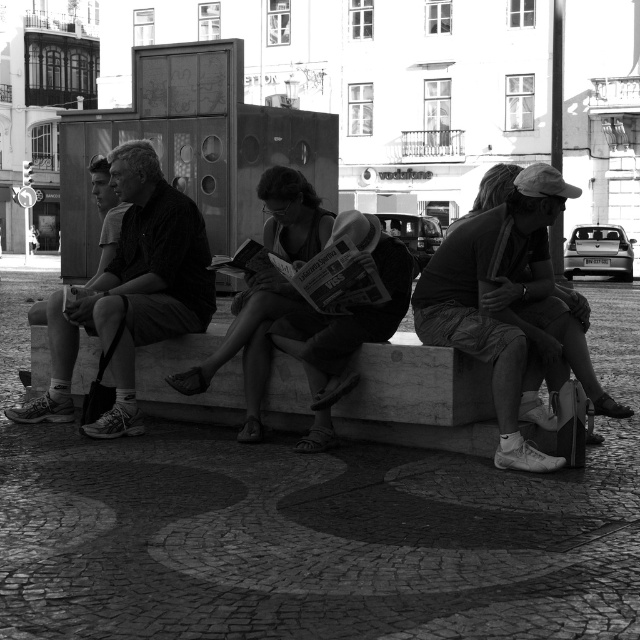
You are a photographer standing in the public square and want to take a picture of the smooth black shirt at left and the matte black dress at center. Which object is closer to the camera?

The smooth black shirt at left is positioned under the matte black dress at center, so the matte black dress at center is closer to the camera.

You are standing at the center of the cobblestone square and see two points marked on the ground. The first point is labeled as point (x=381, y=355) and the second is point (x=294, y=186). If you want to walk towards the point that is closer to you, which point should you head towards?

Point (x=381, y=355) is in front of point (x=294, y=186), so you should head towards point (x=381, y=355) as it is closer to your current position.